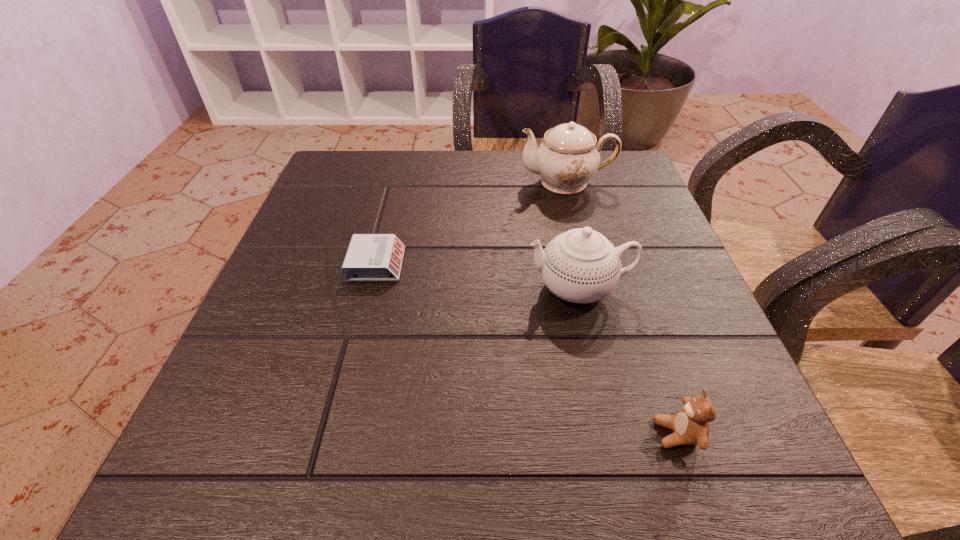
Where is `vacant region located on the spout of the nearer chinaware`? The height and width of the screenshot is (540, 960). vacant region located on the spout of the nearer chinaware is located at coordinates (366, 287).

The width and height of the screenshot is (960, 540). Identify the location of free region located 0.180m on the spout of the nearer chinaware. (427, 287).

I want to click on free location located 0.080m on the front-facing side of the second shortest object, so click(597, 434).

Locate an element on the screen. This screenshot has width=960, height=540. vacant space located 0.140m on the front-facing side of the second shortest object is located at coordinates (553, 434).

What are the coordinates of `free space located on the front-facing side of the second shortest object` in the screenshot? It's located at tap(435, 434).

This screenshot has height=540, width=960. Find the location of `vacant space located on the front of the shortest object`. vacant space located on the front of the shortest object is located at coordinates (355, 348).

Locate an element on the screen. object at the far edge is located at coordinates (568, 157).

Where is `object present at the near edge`? The width and height of the screenshot is (960, 540). object present at the near edge is located at coordinates (690, 425).

Identify the location of object that is at the left edge. The image size is (960, 540). (370, 257).

Locate an element on the screen. teddy bear positioned at the right edge is located at coordinates (690, 425).